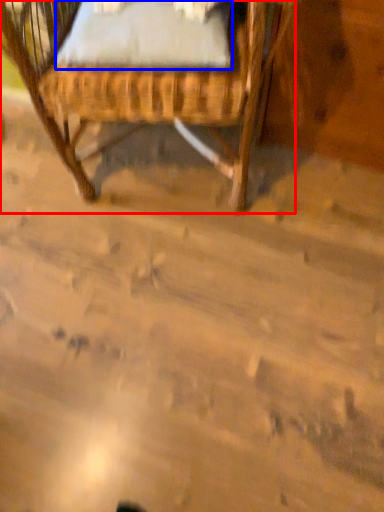
Question: Which of the following is the closest to the observer, chair (highlighted by a red box) or sheet (highlighted by a blue box)?

Choices:
 (A) chair
 (B) sheet

Answer: (A)